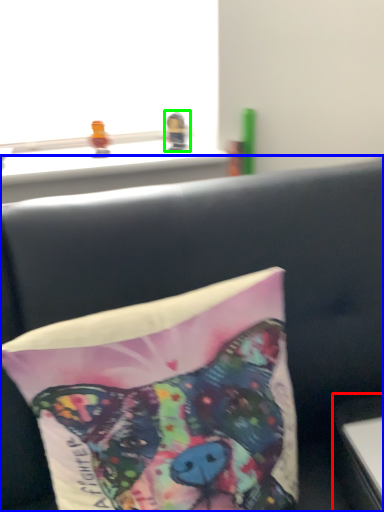
Question: Based on their relative distances, which object is nearer to table (highlighted by a red box)? Choose from furniture (highlighted by a blue box) and toy (highlighted by a green box).

Choices:
 (A) furniture
 (B) toy

Answer: (A)